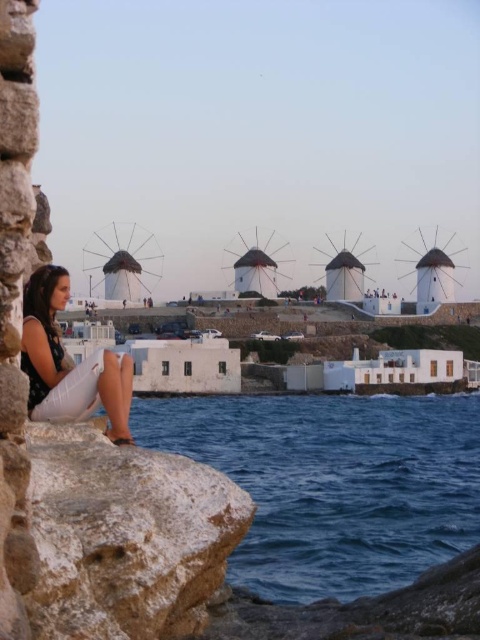
Question: Does blue water at lower left have a smaller size compared to matte black dress at lower left?

Choices:
 (A) yes
 (B) no

Answer: (B)

Question: Which of the following is the closest to the observer?

Choices:
 (A) white rough rock at lower left
 (B) matte black dress at lower left

Answer: (A)

Question: Estimate the real-world distances between objects in this image. Which object is farther from the white rough rock at lower left?

Choices:
 (A) matte black dress at lower left
 (B) blue water at lower left

Answer: (B)

Question: Does blue water at lower left appear on the left side of white rough rock at lower left?

Choices:
 (A) no
 (B) yes

Answer: (A)

Question: Does blue water at lower left have a greater width compared to white rough rock at lower left?

Choices:
 (A) yes
 (B) no

Answer: (A)

Question: Which point is closer to the camera?

Choices:
 (A) (55, 621)
 (B) (28, 285)
 (C) (273, 420)

Answer: (A)